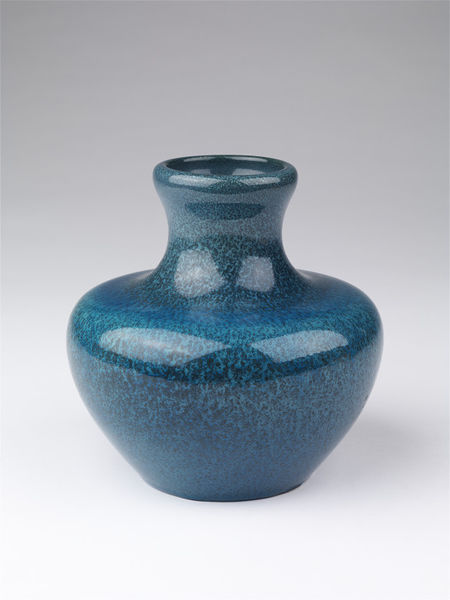
The height and width of the screenshot is (600, 450). Identify the location of base of pot. (220, 502).